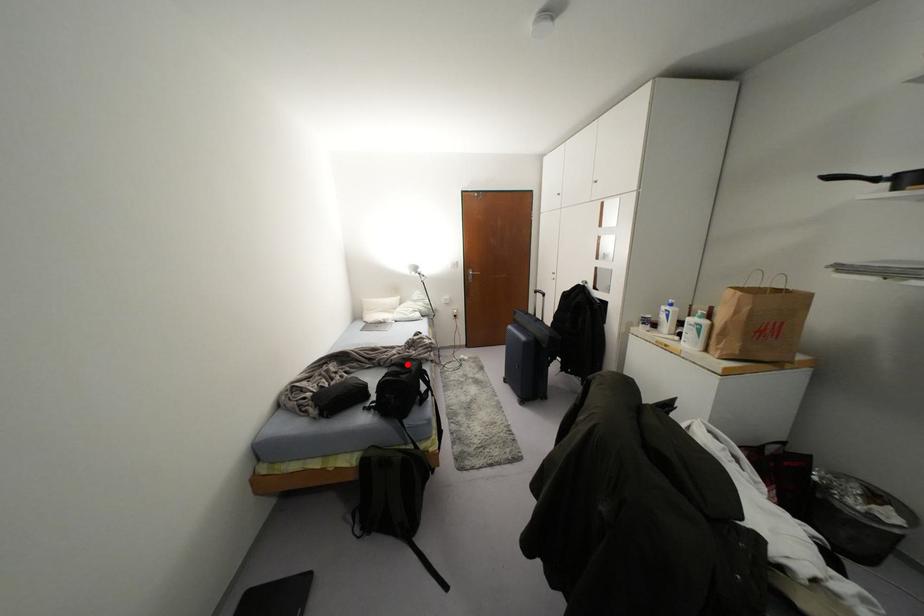
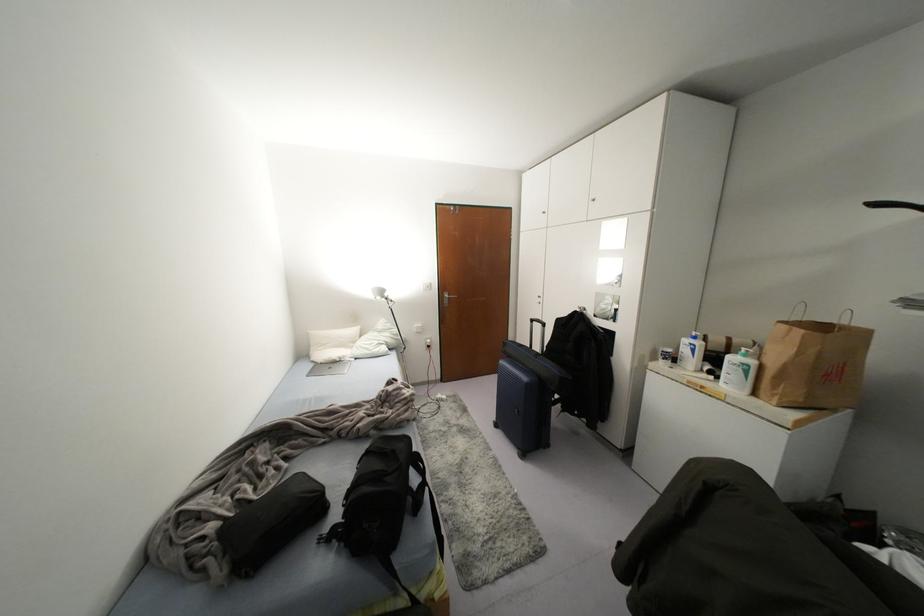
In the second image, find the point that corresponds to the highlighted location in the first image.

(393, 451)